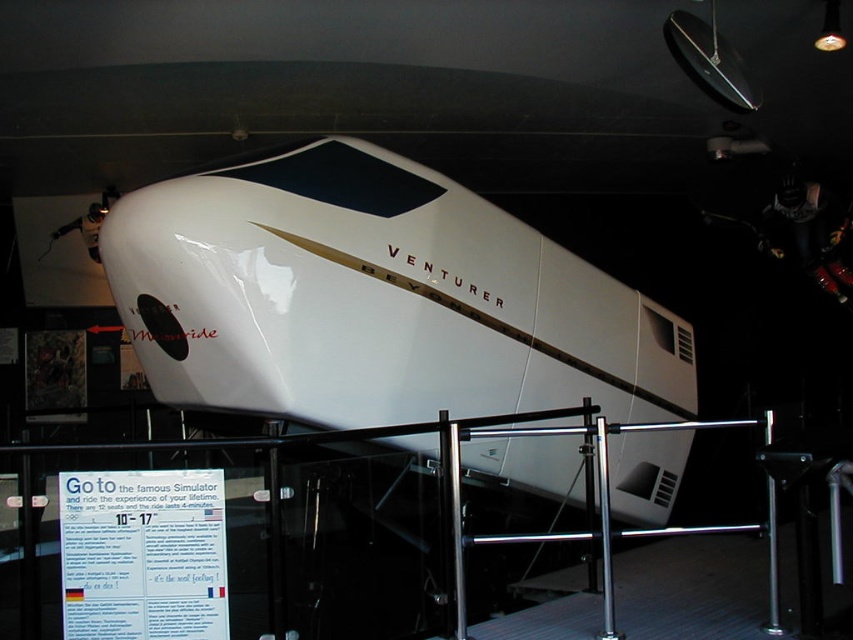
You are standing in the exhibition hall and want to take a photo of the white glossy bullet train at center without the polished metal railing at lower center appearing in the shot. How should you position yourself?

Move closer to the white glossy bullet train at center so that it blocks the view of the polished metal railing at lower center, as the train is closer to you than the railing.

You are a photographer standing at the camera position. The white glossy bullet train at center is your subject. You want to ensure that your camera is exactly 12 feet away from the subject to capture the perfect shot. Based on the scene description, can you confirm if your current position is correct?

The white glossy bullet train at center and camera are 12.19 feet apart from each other. Since 12.19 feet is approximately 12 feet, your current position is correct for capturing the perfect shot.